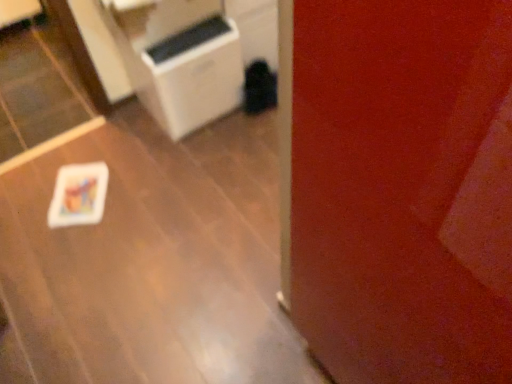
Identify the location of blank space above white glossy table at lower left (from a real-world perspective). This screenshot has height=384, width=512. (134, 234).